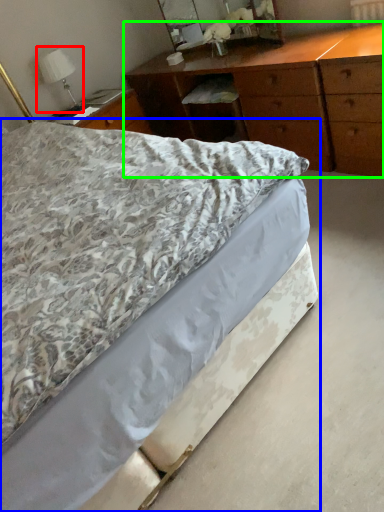
Question: Considering the real-world distances, which object is closest to bedside lamp (highlighted by a red box)? bed (highlighted by a blue box) or chest of drawers (highlighted by a green box).

Choices:
 (A) bed
 (B) chest of drawers

Answer: (B)